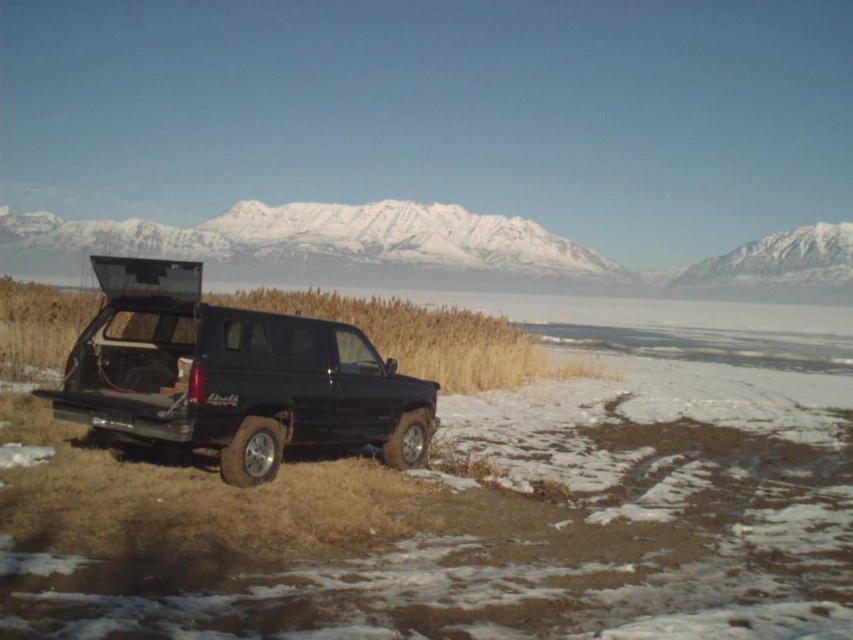
Question: Which point is farther to the camera?

Choices:
 (A) (204, 432)
 (B) (206, 243)

Answer: (B)

Question: Where is black matte truck at center located in relation to snowy white mountain at upper center in the image?

Choices:
 (A) below
 (B) above

Answer: (A)

Question: Does black matte truck at center have a greater width compared to snowy white mountain at upper center?

Choices:
 (A) yes
 (B) no

Answer: (B)

Question: Among these points, which one is nearest to the camera?

Choices:
 (A) pos(167,339)
 (B) pos(798,273)

Answer: (A)

Question: Is black matte truck at center wider than snowy white mountain at upper center?

Choices:
 (A) yes
 (B) no

Answer: (B)